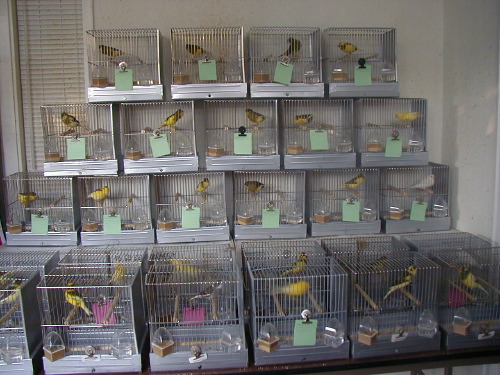
Where is `water dish`? The image size is (500, 375). water dish is located at coordinates (160, 343).